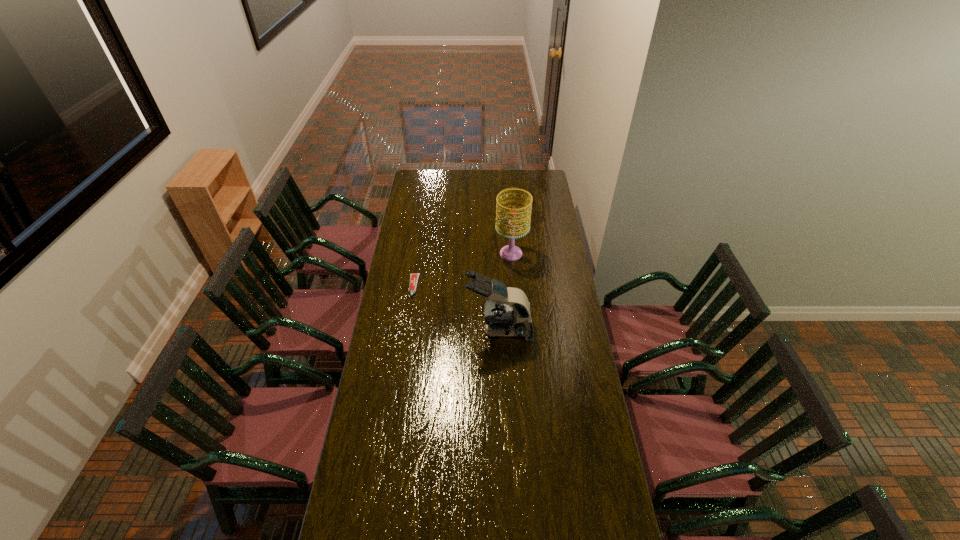
The height and width of the screenshot is (540, 960). I want to click on lampshade, so click(x=510, y=252).

The width and height of the screenshot is (960, 540). Identify the location of the nearest object. (507, 312).

The width and height of the screenshot is (960, 540). I want to click on the leftmost object, so click(413, 282).

Where is `the shortest object`? the shortest object is located at coordinates (413, 282).

Identify the location of blank space located on the front of the lampshade. [x=515, y=301].

You are a GUI agent. You are given a task and a screenshot of the screen. Output one action in this format:
    pyautogui.click(x=<x>, y=<y>)
    Task: Click on the free space located through the eyepieces of the microscope
    Image resolution: width=960 pixels, height=540 pixels.
    Given the screenshot: What is the action you would take?
    pyautogui.click(x=434, y=330)

Find the location of `vacant space situated through the eyepieces of the microscope`. vacant space situated through the eyepieces of the microscope is located at coordinates (456, 330).

At what (x,y) coordinates should I click in order to perform the action: click on free spot located through the eyepieces of the microscope. Please return your answer as a coordinate pair (x, y). The width and height of the screenshot is (960, 540). Looking at the image, I should click on (414, 330).

The height and width of the screenshot is (540, 960). I want to click on free space located 0.140m at the nozzle of the leftmost object, so click(x=409, y=320).

Where is `object at the left edge`? The image size is (960, 540). object at the left edge is located at coordinates (413, 282).